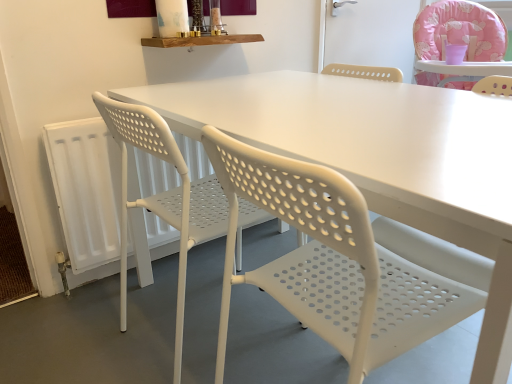
This screenshot has height=384, width=512. I want to click on free space in front of white plastic radiator at lower left, so click(118, 327).